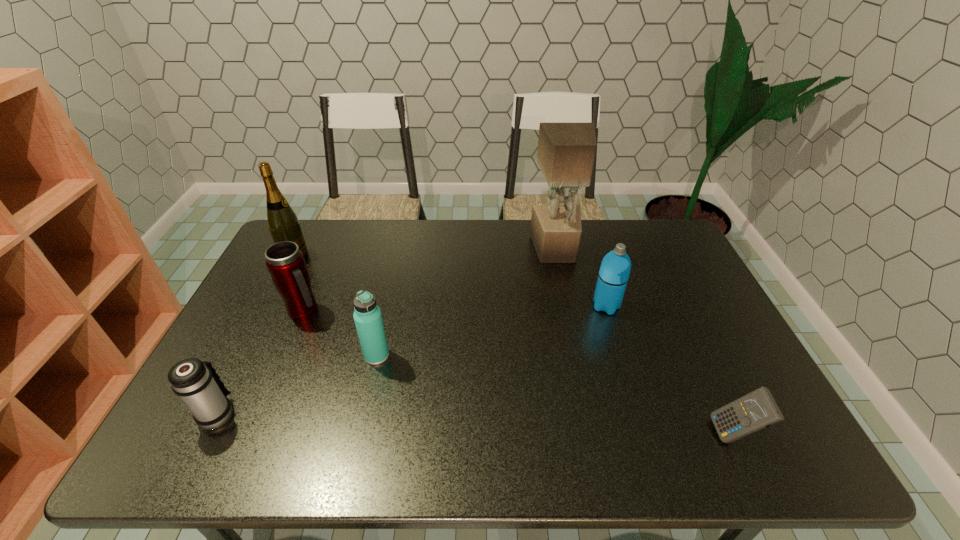
Locate an element on the screen. The height and width of the screenshot is (540, 960). vacant space at the far edge of the desktop is located at coordinates (349, 250).

The image size is (960, 540). I want to click on vacant area at the near edge of the desktop, so click(459, 441).

Where is `free space at the left edge`? The image size is (960, 540). free space at the left edge is located at coordinates [x=275, y=291].

I want to click on free space at the right edge of the desktop, so click(x=658, y=289).

This screenshot has width=960, height=540. In the image, there is a desktop. Identify the location of vacant space at the near right corner. (789, 459).

Find the location of a particular element. This screenshot has height=540, width=960. free spot between the second thermos bottle from left to right and the calculator is located at coordinates (518, 373).

Locate an element on the screen. The width and height of the screenshot is (960, 540). vacant space in between the third object from left to right and the tallest object is located at coordinates (430, 280).

Find the location of a particular element. The width and height of the screenshot is (960, 540). vacant region between the rightmost thermos bottle and the wine bottle is located at coordinates (450, 281).

At what (x,y) coordinates should I click in order to perform the action: click on vacant area that lies between the third thermos bottle from right to left and the tallest object. Please return your answer as a coordinate pair (x, y). This screenshot has height=540, width=960. Looking at the image, I should click on (430, 280).

The height and width of the screenshot is (540, 960). In order to click on free space between the second thermos bottle from left to right and the second thermos bottle from right to left in this screenshot , I will do click(x=341, y=334).